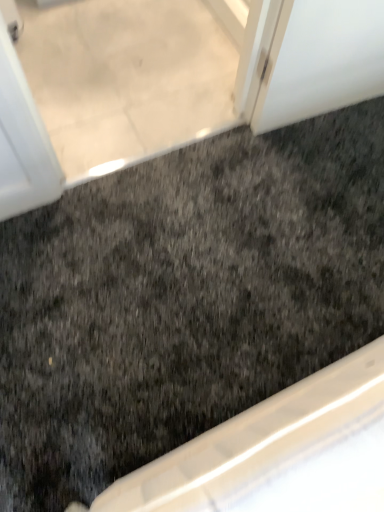
This screenshot has width=384, height=512. Describe the element at coordinates (133, 76) in the screenshot. I see `transparent glass door at upper left` at that location.

At what (x,y) coordinates should I click in order to perform the action: click on transparent glass door at upper left. Please return your answer as a coordinate pair (x, y). This screenshot has height=512, width=384. Looking at the image, I should click on (133, 76).

You are a GUI agent. You are given a task and a screenshot of the screen. Output one action in this format:
    pyautogui.click(x=<x>, y=<y>)
    Task: Click on the transparent glass door at upper left
    This screenshot has height=512, width=384.
    Given the screenshot: What is the action you would take?
    pyautogui.click(x=133, y=76)